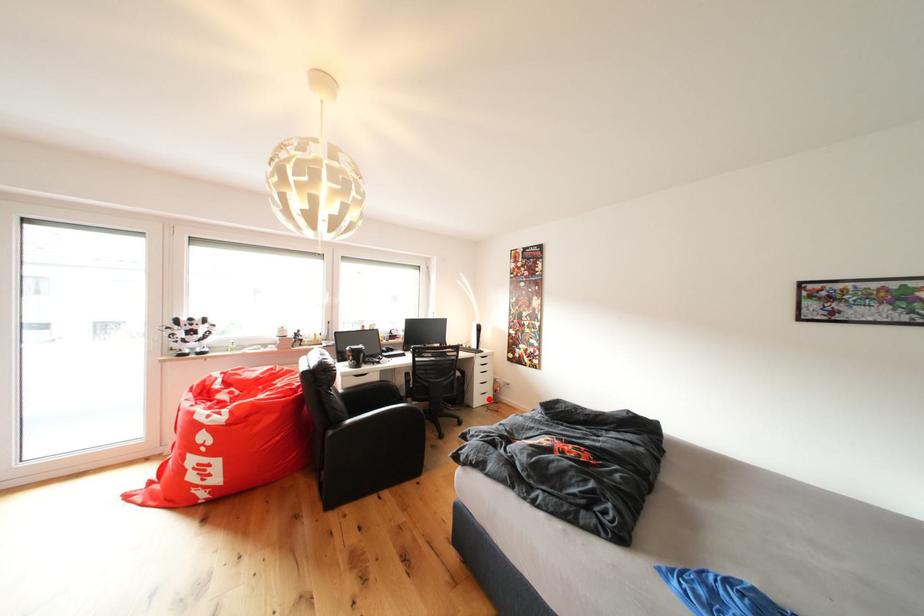
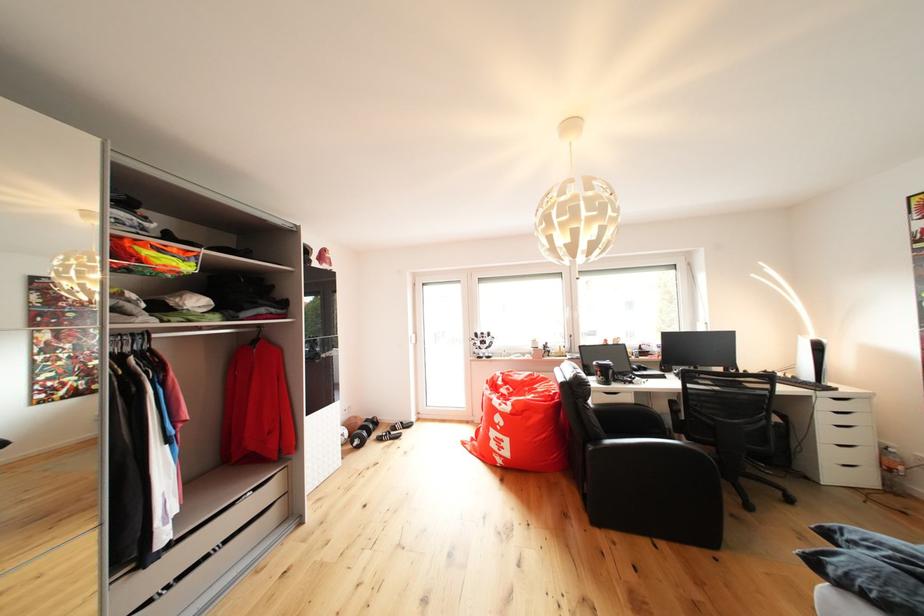
Question: I am providing you with two images of the same scene from different viewpoints. In image1, a red point is highlighted. Considering the same 3D point in image2, which of the following is correct?

Choices:
 (A) It is closer
 (B) It is farther

Answer: (A)